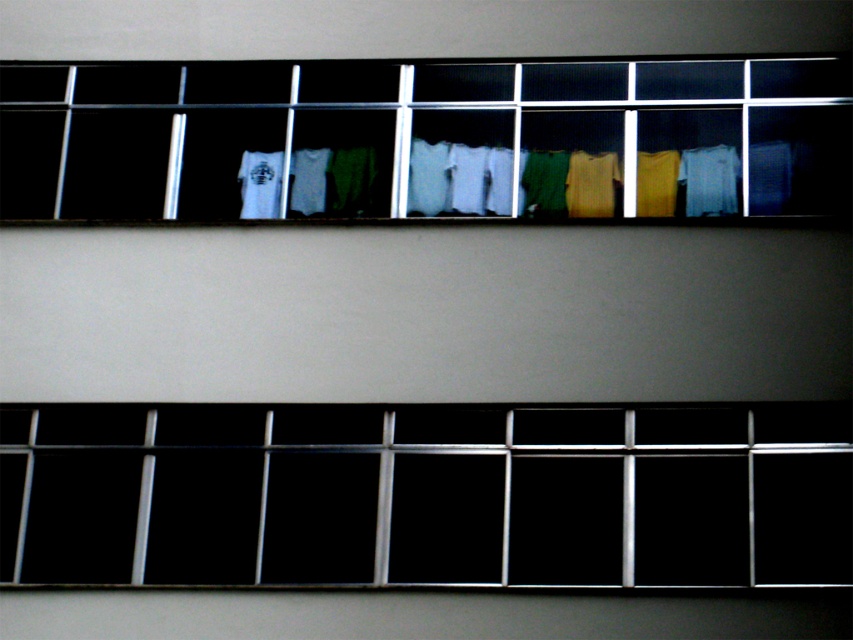
You are a window cleaner holding a 1 meter wide ladder. You need to clean the transparent glass at center and the matte yellow sweater at center. Can you fit the ladder between them?

The transparent glass at center might be wider than matte yellow sweater at center, so the ladder may or may not fit depending on the exact width difference.

You are standing in a room with a window. There is a point marked at coordinates point (611, 552). If you want to touch this point with a 20 meter long pole, can you reach it?

The point (611, 552) is 19.61 meters away from the camera, so yes, you can reach it with a 20 meter long pole since it is slightly shorter than the pole.

You are a window cleaner who needs to ensure that all items hanging on the clothesline between the windows are within the building safety guidelines. According to the guidelines, no item should exceed the width of the window it is adjacent to. Given that the windows are 1 meter wide, can you determine if the white fabric at center and the matte yellow sweater at center comply with the safety regulations?

The white fabric at center is wider than the matte yellow sweater at center. Since the windows are 1 meter wide, the white fabric at center may exceed the window width, violating the safety guidelines, while the matte yellow sweater at center is narrower and likely compliant.